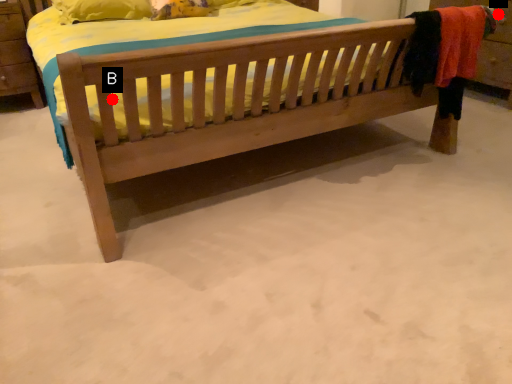
Question: Two points are circled on the image, labeled by A and B beside each circle. Among these points, which one is nearest to the camera?

Choices:
 (A) A is closer
 (B) B is closer

Answer: (B)